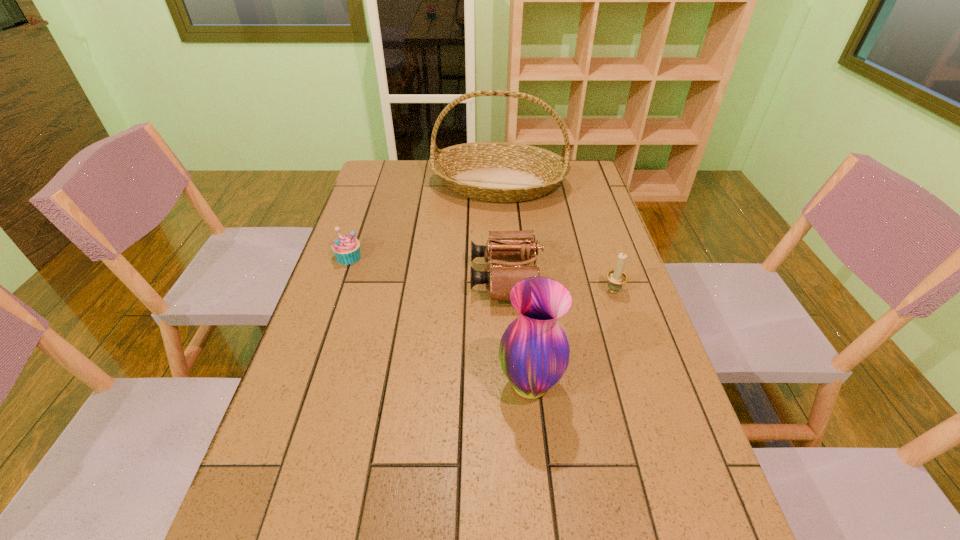
Image resolution: width=960 pixels, height=540 pixels. In order to click on basket in this screenshot , I will do `click(504, 172)`.

Locate an element on the screen. The height and width of the screenshot is (540, 960). the tallest object is located at coordinates (504, 172).

Where is `the nearest object`? the nearest object is located at coordinates (534, 351).

Find the location of `the fourth shortest object`. the fourth shortest object is located at coordinates (534, 351).

Where is `the rightmost object`? The height and width of the screenshot is (540, 960). the rightmost object is located at coordinates (616, 277).

The image size is (960, 540). Find the location of `binoculars`. binoculars is located at coordinates (506, 245).

The image size is (960, 540). Find the location of `the leftmost object`. the leftmost object is located at coordinates (346, 248).

Identify the location of the shortest object. (346, 248).

Identify the location of free space located 0.180m on the left of the tallest object. The image size is (960, 540). (381, 184).

The height and width of the screenshot is (540, 960). In order to click on vacant space located on the right of the vase in this screenshot , I will do `click(630, 385)`.